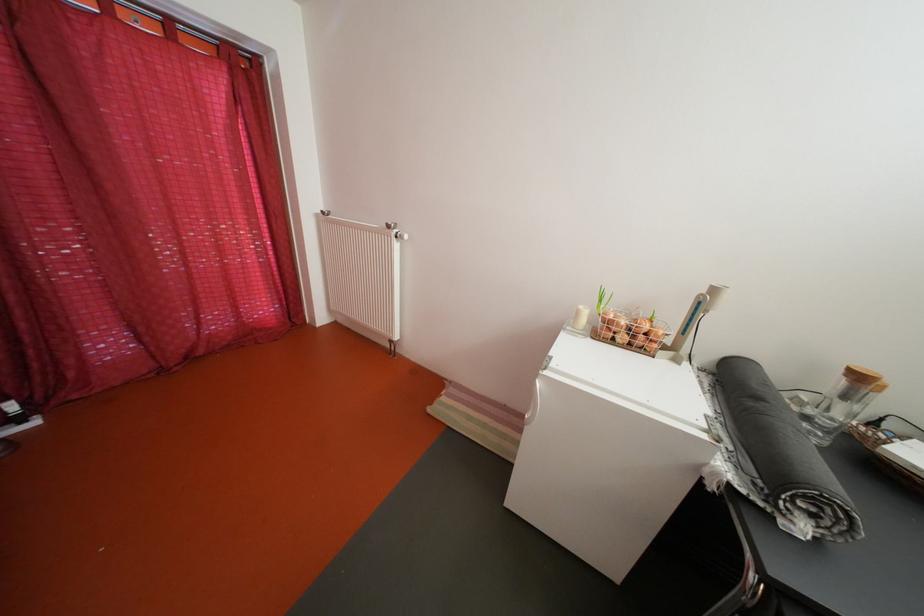
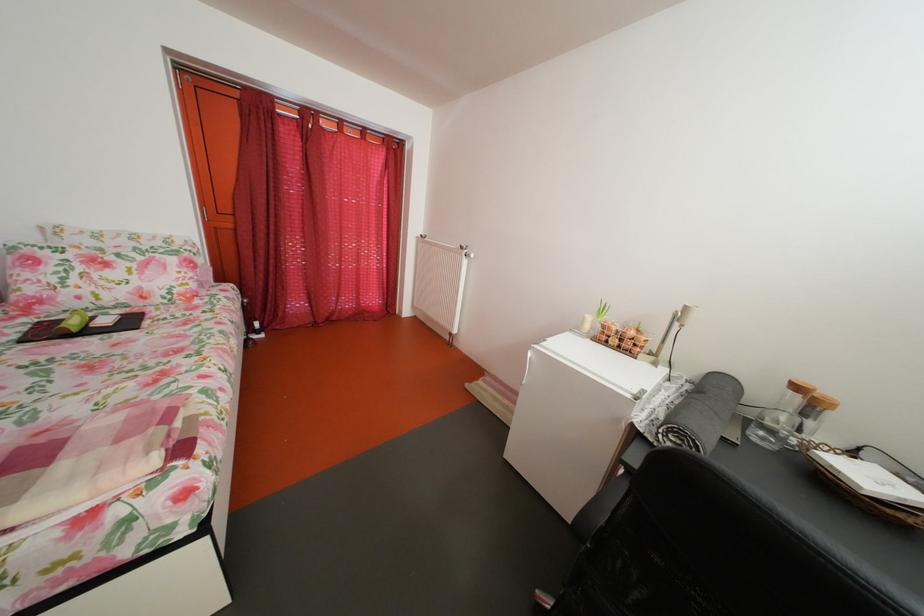
In a continuous first-person perspective shot, in which direction is the camera moving?

The movement direction of the cameraman is right, backward.